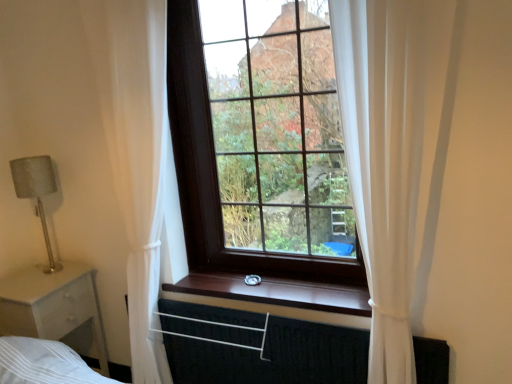
Identify the location of white sheer curtain at right, which appears as the 1th curtain when viewed from the right. (385, 155).

What is the approximate height of black fabric canopy bed at lower center?

It is 20.49 inches.

Locate an element on the screen. Image resolution: width=512 pixels, height=384 pixels. black fabric canopy bed at lower center is located at coordinates (275, 356).

Consider the image. Measure the distance between wooden at center and camera.

They are 1.70 meters apart.

At what (x,y) coordinates should I click in order to perform the action: click on white sheer curtain at right, which appears as the 1th curtain when viewed from the right. Please return your answer as a coordinate pair (x, y). This screenshot has height=384, width=512. Looking at the image, I should click on (385, 155).

Is satin silver lamp at left further to the viewer compared to white sheer curtain at right, which appears as the 1th curtain when viewed from the right?

Yes, satin silver lamp at left is further from the viewer.

From the picture: Does satin silver lamp at left turn towards white sheer curtain at right, which is counted as the second curtain, starting from the left?

Yes, satin silver lamp at left is oriented towards white sheer curtain at right, which is counted as the second curtain, starting from the left.

Would you say satin silver lamp at left is inside or outside white sheer curtain at right, which is counted as the second curtain, starting from the left?

satin silver lamp at left exists outside the volume of white sheer curtain at right, which is counted as the second curtain, starting from the left.

Between satin silver lamp at left and white sheer curtain at right, which appears as the 1th curtain when viewed from the right, which one has larger size?

With larger size is white sheer curtain at right, which appears as the 1th curtain when viewed from the right.

Considering the relative sizes of wooden at center and black fabric canopy bed at lower center in the image provided, is wooden at center thinner than black fabric canopy bed at lower center?

In fact, wooden at center might be wider than black fabric canopy bed at lower center.

Which object is further away from the camera taking this photo, wooden at center or black fabric canopy bed at lower center?

wooden at center is further from the camera.

Is wooden at center in contact with black fabric canopy bed at lower center?

No.

Based on the photo, who is bigger, wooden at center or black fabric canopy bed at lower center?

With larger size is black fabric canopy bed at lower center.

Based on the photo, can you tell me how much white sheer curtain at right, which is counted as the second curtain, starting from the left, and white matte nightstand at left differ in facing direction?

The angle between the facing direction of white sheer curtain at right, which is counted as the second curtain, starting from the left, and the facing direction of white matte nightstand at left is 89.1 degrees.

Considering the sizes of white sheer curtain at right, which appears as the 1th curtain when viewed from the right, and white matte nightstand at left in the image, is white sheer curtain at right, which appears as the 1th curtain when viewed from the right, taller or shorter than white matte nightstand at left?

Clearly, white sheer curtain at right, which appears as the 1th curtain when viewed from the right, is taller compared to white matte nightstand at left.

From a real-world perspective, does white sheer curtain at right, which appears as the 1th curtain when viewed from the right, sit lower than white matte nightstand at left?

No, from a real-world perspective, white sheer curtain at right, which appears as the 1th curtain when viewed from the right, is not under white matte nightstand at left.

Consider the image. From the image's perspective, between white sheer curtain at right, which is counted as the second curtain, starting from the left, and wooden at center, who is located below?

wooden at center is shown below in the image.

Which point is more forward, (x=416, y=177) or (x=264, y=297)?

The point (x=416, y=177) is more forward.

From a real-world perspective, is white sheer curtain at right, which is counted as the second curtain, starting from the left, physically above wooden at center?

Yes, from a real-world perspective, white sheer curtain at right, which is counted as the second curtain, starting from the left, is above wooden at center.

Find the location of a particular element. The width and height of the screenshot is (512, 384). curtain to the right of wooden at center is located at coordinates (385, 155).

Could satin silver lamp at left be considered to be inside white sheer curtain at left, acting as the second curtain starting from the right?

No, satin silver lamp at left is not surrounded by white sheer curtain at left, acting as the second curtain starting from the right.

Which of these two, white sheer curtain at left, which is counted as the 1th curtain, starting from the left, or satin silver lamp at left, is smaller?

satin silver lamp at left.

Consider the image. From a real-world perspective, which object rests below the other?

satin silver lamp at left, from a real-world perspective.

The image size is (512, 384). I want to click on table lamp that appears below the white sheer curtain at left, acting as the second curtain starting from the right (from a real-world perspective), so click(36, 192).

Is white matte nightstand at left closer to the viewer compared to dark wood window at center?

No, white matte nightstand at left is further to the viewer.

Is white matte nightstand at left oriented away from dark wood window at center?

A: white matte nightstand at left is not turned away from dark wood window at center.

At what (x,y) coordinates should I click in order to perform the action: click on nightstand below the satin silver lamp at left (from the image's perspective). Please return your answer as a coordinate pair (x, y). Looking at the image, I should click on (52, 305).

Is white matte nightstand at left a part of satin silver lamp at left?

That's incorrect, white matte nightstand at left is not inside satin silver lamp at left.

Is satin silver lamp at left directly adjacent to white matte nightstand at left?

No, satin silver lamp at left is not with white matte nightstand at left.

You are a GUI agent. You are given a task and a screenshot of the screen. Output one action in this format:
    pyautogui.click(x=<x>, y=<y>)
    Task: Click on the curtain that is the 2nd object above the satin silver lamp at left (from a real-world perspective)
    
    Given the screenshot: What is the action you would take?
    385,155

What are the coordinates of `window sill that appears on the right of black fabric canopy bed at lower center` in the screenshot? It's located at (277, 292).

Which object lies further to the anchor point dark wood window at center, white sheer curtain at right, which is counted as the second curtain, starting from the left, or wooden at center?

Among the two, white sheer curtain at right, which is counted as the second curtain, starting from the left, is located further to dark wood window at center.

Looking at the image, which one is located closer to satin silver lamp at left, black fabric canopy bed at lower center or white sheer curtain at right, which appears as the 1th curtain when viewed from the right?

The object closer to satin silver lamp at left is black fabric canopy bed at lower center.

Looking at this image, from the image, which object appears to be nearer to white sheer curtain at right, which is counted as the second curtain, starting from the left, satin silver lamp at left or white matte nightstand at left?

white matte nightstand at left lies closer to white sheer curtain at right, which is counted as the second curtain, starting from the left, than the other object.

Estimate the real-world distances between objects in this image. Which object is closer to satin silver lamp at left, dark wood window at center or black fabric canopy bed at lower center?

dark wood window at center.

When comparing their distances from satin silver lamp at left, does white matte nightstand at left or black fabric canopy bed at lower center seem further?

Based on the image, black fabric canopy bed at lower center appears to be further to satin silver lamp at left.

Considering their positions, is white sheer curtain at left, acting as the second curtain starting from the right, positioned further to white sheer curtain at right, which is counted as the second curtain, starting from the left, than dark wood window at center?

white sheer curtain at left, acting as the second curtain starting from the right.

Which object lies nearer to the anchor point white matte nightstand at left, black fabric canopy bed at lower center or wooden at center?

wooden at center.

From the picture: Based on their spatial positions, is white matte nightstand at left or wooden at center closer to dark wood window at center?

wooden at center is positioned closer to the anchor dark wood window at center.

Find the location of a particular element. The image size is (512, 384). curtain between satin silver lamp at left and wooden at center in the horizontal direction is located at coordinates (135, 153).

Identify the location of window located between satin silver lamp at left and wooden at center in the left-right direction. (260, 140).

This screenshot has width=512, height=384. I want to click on window between white matte nightstand at left and white sheer curtain at right, which appears as the 1th curtain when viewed from the right, in the horizontal direction, so click(260, 140).

I want to click on curtain situated between white matte nightstand at left and black fabric canopy bed at lower center from left to right, so click(x=135, y=153).